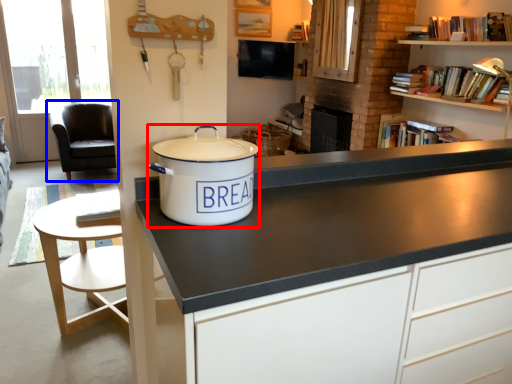
Question: Among these objects, which one is farthest to the camera, cooker (highlighted by a red box) or chair (highlighted by a blue box)?

Choices:
 (A) cooker
 (B) chair

Answer: (B)